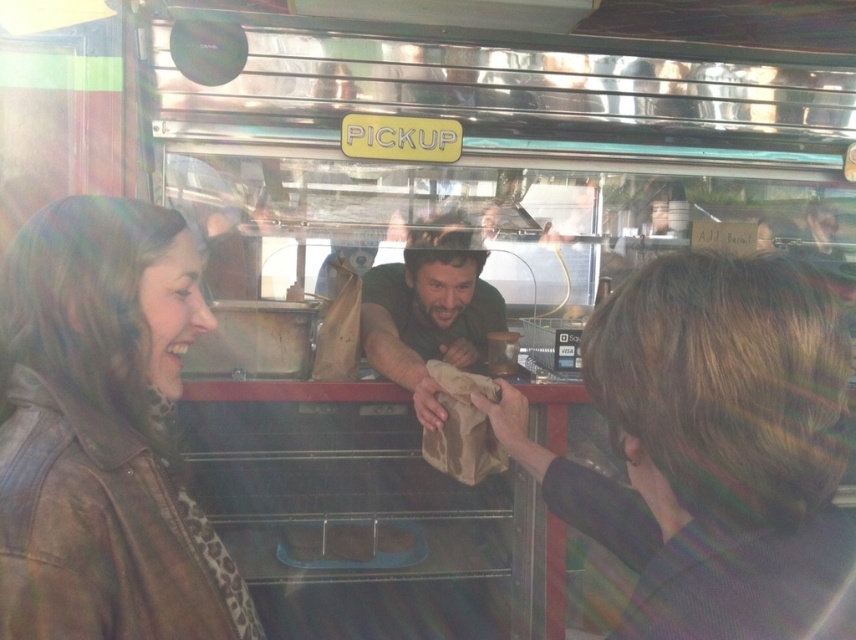
Between brown paper bag at center and green fabric shirt at center, which one is positioned lower?

brown paper bag at center is lower down.

Does point (732, 307) lie in front of point (421, 410)?

Yes, point (732, 307) is closer to viewer.

Who is more forward, (705, 429) or (417, 228)?

Positioned in front is point (705, 429).

Locate an element on the screen. The image size is (856, 640). brown paper bag at center is located at coordinates (712, 449).

Is brown leather jacket at left wider than green fabric shirt at center?

Incorrect, brown leather jacket at left's width does not surpass green fabric shirt at center's.

Between brown leather jacket at left and green fabric shirt at center, which one is positioned higher?

Positioned higher is green fabric shirt at center.

Is point (107, 413) less distant than point (461, 284)?

Yes, it is.

This screenshot has height=640, width=856. Identify the location of brown leather jacket at left. (103, 433).

Is brown paper bag at center bigger than brown leather jacket at left?

Yes.

Is point (698, 292) less distant than point (28, 608)?

Yes, point (698, 292) is closer to viewer.

This screenshot has height=640, width=856. I want to click on brown paper bag at center, so click(x=712, y=449).